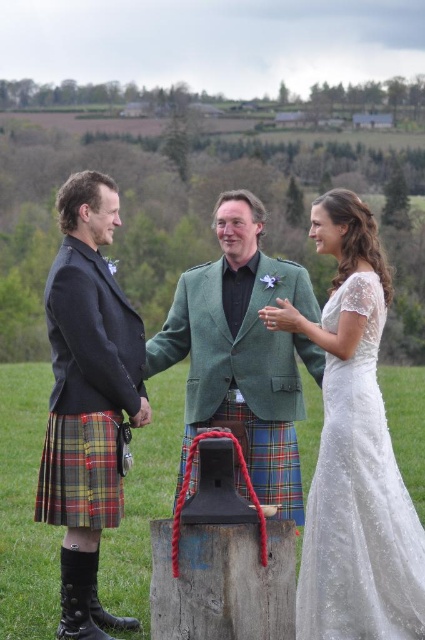
Question: Can you confirm if plaid fabric kilt at lower left is smaller than plaid fabric kilt at center?

Choices:
 (A) no
 (B) yes

Answer: (B)

Question: Is plaid wool kilt at center positioned behind white lace dress at right?

Choices:
 (A) no
 (B) yes

Answer: (B)

Question: Estimate the real-world distances between objects in this image. Which object is closer to the plaid wool kilt at center?

Choices:
 (A) plaid fabric kilt at center
 (B) green wool kilt at center
 (C) white lace dress at right

Answer: (B)

Question: Can you confirm if green wool kilt at center is positioned to the right of white lace dress at right?

Choices:
 (A) no
 (B) yes

Answer: (A)

Question: Which point is farther to the camera?

Choices:
 (A) (234, 413)
 (B) (102, 420)
 (C) (42, 499)
 (D) (393, 486)

Answer: (A)

Question: Which point appears closest to the camera in this image?

Choices:
 (A) (209, 305)
 (B) (325, 324)
 (C) (257, 259)
 (D) (95, 616)

Answer: (D)